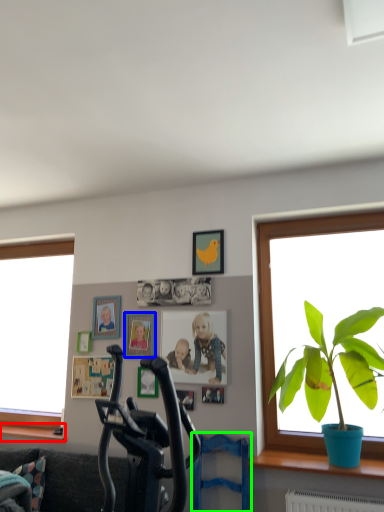
Question: Which object is the farthest from window sill (highlighted by a red box)? Choose among these: picture frame (highlighted by a blue box) or swivel chair (highlighted by a green box).

Choices:
 (A) picture frame
 (B) swivel chair

Answer: (B)